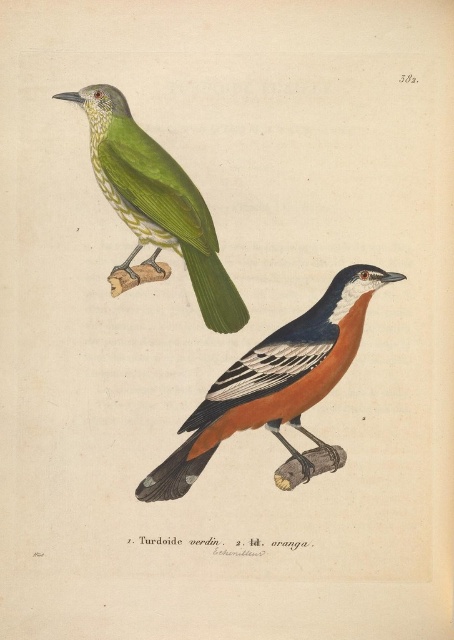
Question: Which of the following is the closest to the observer?

Choices:
 (A) green speckled feathers at upper left
 (B) orange matte bird at center

Answer: (B)

Question: Observing the image, what is the correct spatial positioning of orange matte bird at center in reference to green speckled feathers at upper left?

Choices:
 (A) right
 (B) left

Answer: (A)

Question: Can you confirm if orange matte bird at center is positioned above green speckled feathers at upper left?

Choices:
 (A) yes
 (B) no

Answer: (B)

Question: Among these objects, which one is nearest to the camera?

Choices:
 (A) orange matte bird at center
 (B) green speckled feathers at upper left

Answer: (A)

Question: Is orange matte bird at center smaller than green speckled feathers at upper left?

Choices:
 (A) yes
 (B) no

Answer: (A)